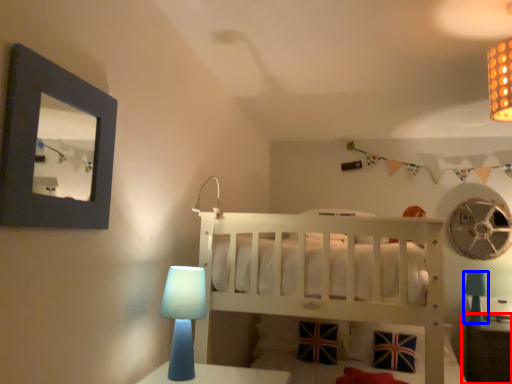
Question: Among these objects, which one is farthest to the camera, table (highlighted by a red box) or table lamp (highlighted by a blue box)?

Choices:
 (A) table
 (B) table lamp

Answer: (B)